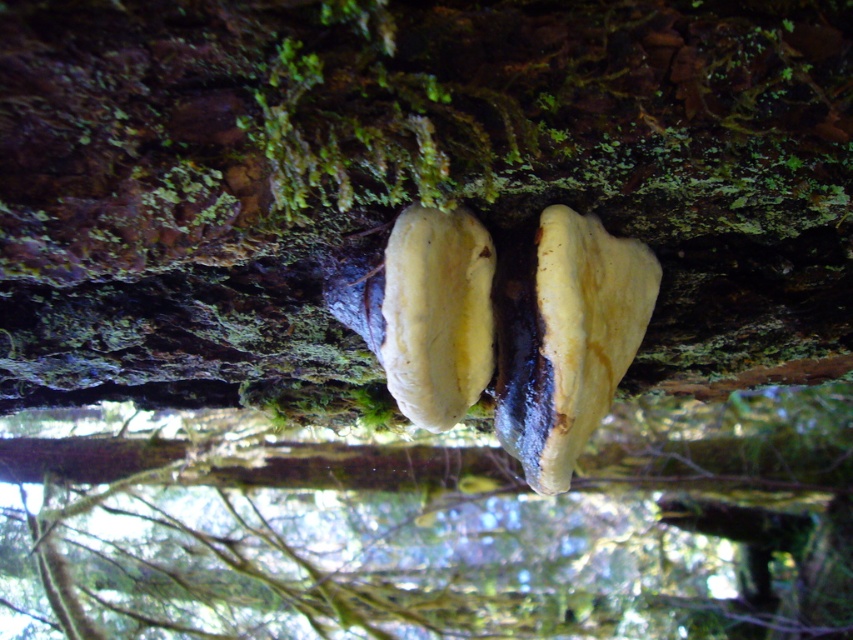
From the picture: Is yellowish matte fungus at center shorter than yellowish matte mushroom at center?

In fact, yellowish matte fungus at center may be taller than yellowish matte mushroom at center.

Is point (577, 284) positioned in front of point (428, 388)?

Yes, point (577, 284) is in front of point (428, 388).

The width and height of the screenshot is (853, 640). In order to click on yellowish matte fungus at center in this screenshot , I will do `click(564, 336)`.